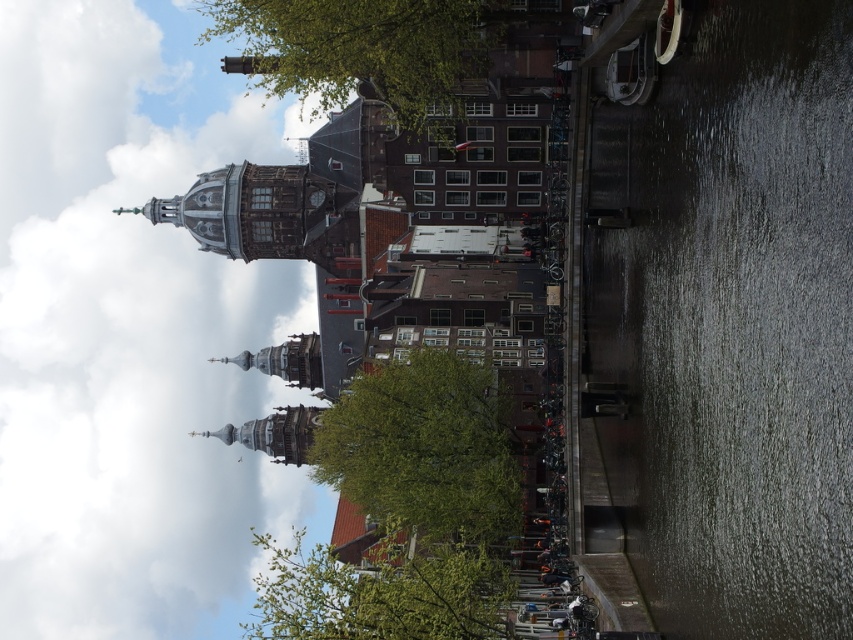
What do you see at coordinates (131, 330) in the screenshot? I see `white fluffy cloud at upper left` at bounding box center [131, 330].

Consider the image. Does white fluffy cloud at upper left have a larger size compared to dark gray concrete waterway at right?

Yes.

Is point (78, 557) positioned after point (712, 404)?

Yes.

Locate an element on the screen. white fluffy cloud at upper left is located at coordinates (131, 330).

How distant is green leafy tree at center from green leafy tree at upper center?

green leafy tree at center is 20.91 meters from green leafy tree at upper center.

Is green leafy tree at center to the left of green leafy tree at upper center from the viewer's perspective?

In fact, green leafy tree at center is to the right of green leafy tree at upper center.

Where is `green leafy tree at center`? This screenshot has width=853, height=640. green leafy tree at center is located at coordinates (421, 452).

You are a GUI agent. You are given a task and a screenshot of the screen. Output one action in this format:
    pyautogui.click(x=<x>, y=<y>)
    Task: Click on the white fluffy cloud at upper left
    The width and height of the screenshot is (853, 640).
    Given the screenshot: What is the action you would take?
    pyautogui.click(x=131, y=330)

Is white fluffy cloud at upper left closer to the viewer compared to green leafy tree at lower center?

No.

Between point (59, 289) and point (364, 634), which one is positioned behind?

Positioned behind is point (59, 289).

I want to click on white fluffy cloud at upper left, so click(131, 330).